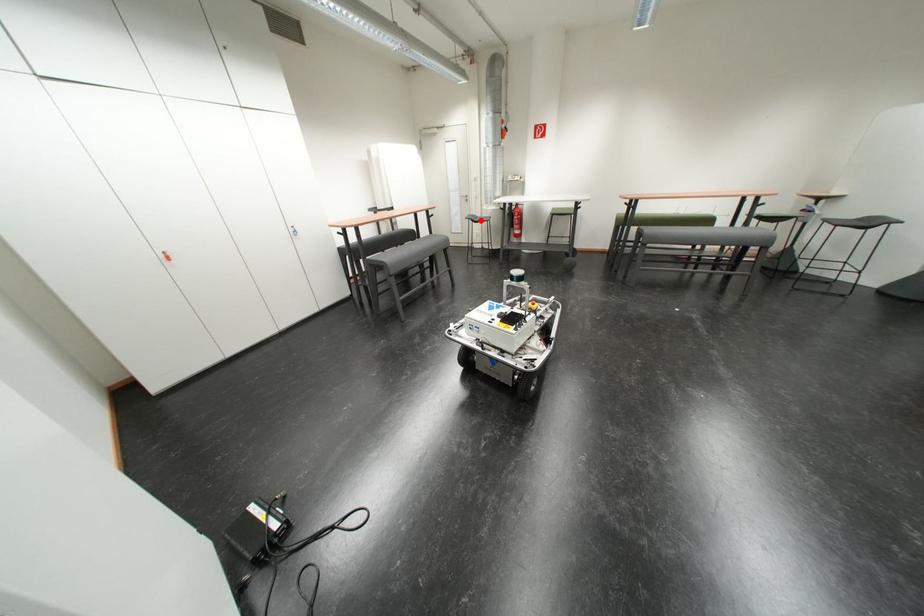
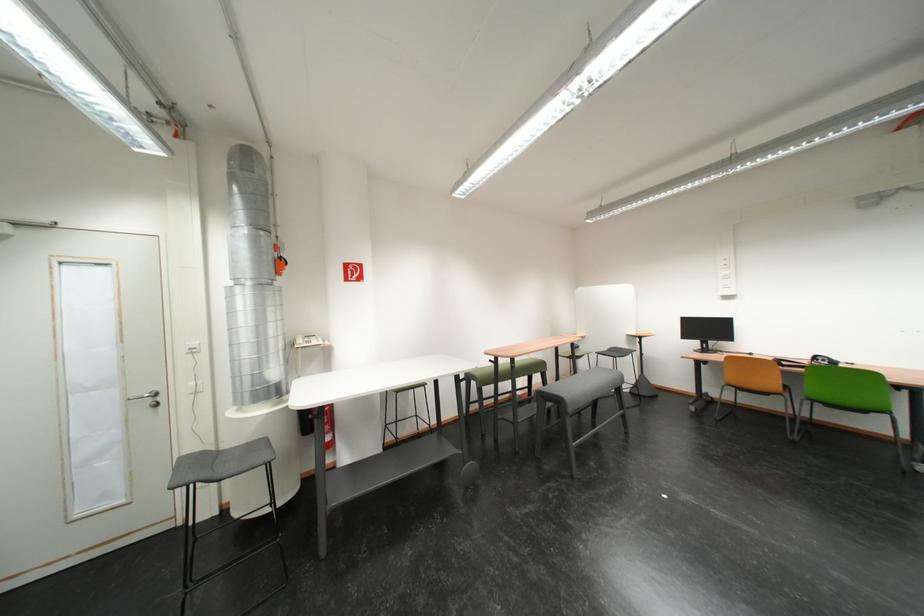
Question: I am providing you with two images of the same scene from different viewpoints. In image1, a red point is highlighted. Considering the same 3D point in image2, which of the following is correct?

Choices:
 (A) It is closer
 (B) It is farther

Answer: (B)